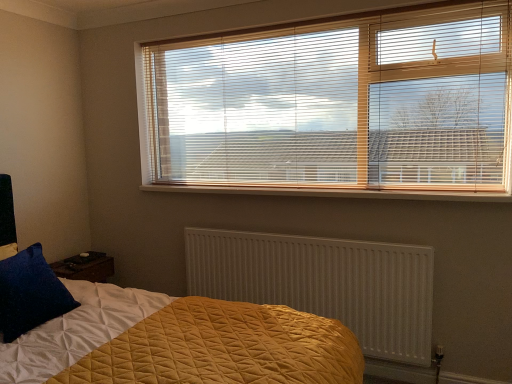
Question: Can you confirm if white textured radiator at center is wider than wooden at center?

Choices:
 (A) yes
 (B) no

Answer: (B)

Question: Is white textured radiator at center outside of wooden at center?

Choices:
 (A) no
 (B) yes

Answer: (B)

Question: Is white textured radiator at center to the right of wooden at center from the viewer's perspective?

Choices:
 (A) no
 (B) yes

Answer: (A)

Question: Is white textured radiator at center smaller than wooden at center?

Choices:
 (A) yes
 (B) no

Answer: (B)

Question: From the image's perspective, does white textured radiator at center appear lower than wooden at center?

Choices:
 (A) yes
 (B) no

Answer: (A)

Question: Is wooden at center at the back of white textured radiator at center?

Choices:
 (A) no
 (B) yes

Answer: (A)

Question: Is wooden at center smaller than velvety blue pillow at lower left?

Choices:
 (A) no
 (B) yes

Answer: (B)

Question: Is wooden at center wider than velvety blue pillow at lower left?

Choices:
 (A) yes
 (B) no

Answer: (A)

Question: Is wooden at center positioned behind velvety blue pillow at lower left?

Choices:
 (A) yes
 (B) no

Answer: (A)

Question: Is wooden at center in front of velvety blue pillow at lower left?

Choices:
 (A) yes
 (B) no

Answer: (B)

Question: From a real-world perspective, is wooden at center on velvety blue pillow at lower left?

Choices:
 (A) no
 (B) yes

Answer: (B)

Question: Is wooden at center shorter than velvety blue pillow at lower left?

Choices:
 (A) no
 (B) yes

Answer: (B)

Question: Could you tell me if velvety blue pillow at lower left is facing wooden at center?

Choices:
 (A) no
 (B) yes

Answer: (A)